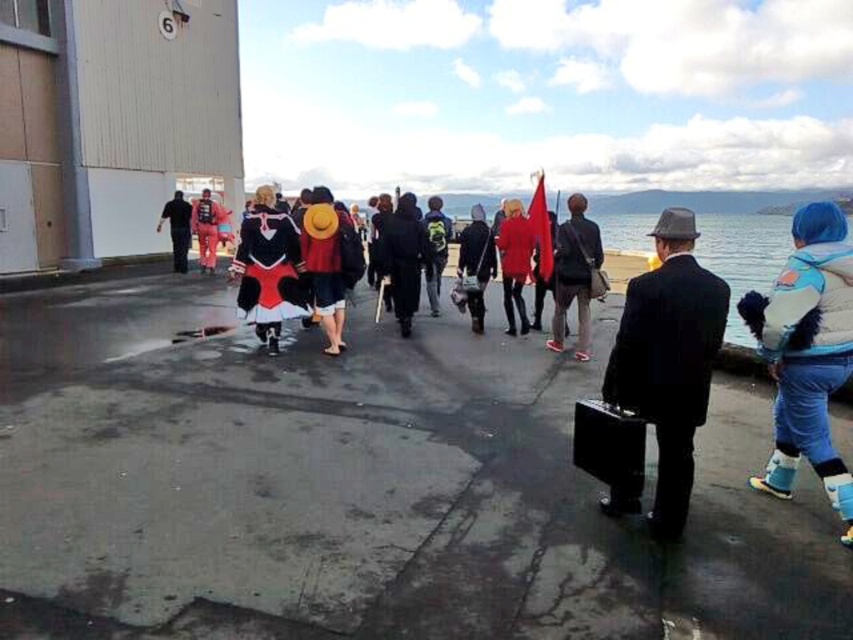
You are standing at the center of the waterfront area and need to find the blue fuzzy boots at lower right. According to the coordinates provided, in which direction should you move to reach them?

The blue fuzzy boots at lower right is located at point 0.553 on the x and 0.947 on the y. Since the coordinates are based on a scale from 0 to 1, with 0 being the bottom left corner, moving towards the lower right direction from the center would lead you to the blue fuzzy boots at lower right.

You are a photographer trying to capture a wide shot of the group. You notice the blue fuzzy boots at lower right and the black matte coat at center in your frame. Considering their widths, which object should you ensure stays fully visible to avoid cropping?

The black matte coat at center has a greater width than the blue fuzzy boots at lower right, so you should prioritize keeping the black matte coat at center fully visible in the frame to avoid cropping.